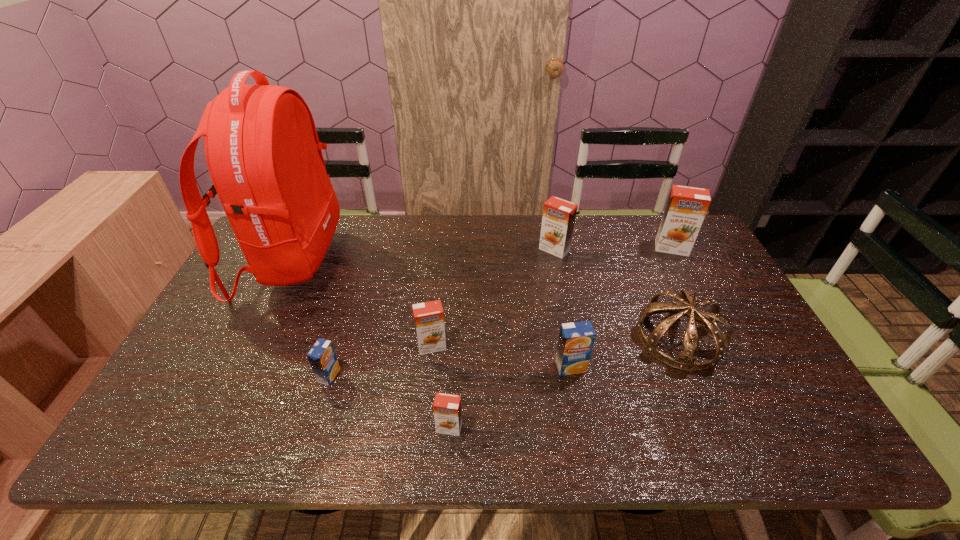
The width and height of the screenshot is (960, 540). What are the coordinates of `free spot at the near edge of the desktop` in the screenshot? It's located at (321, 418).

Image resolution: width=960 pixels, height=540 pixels. Identify the location of vacant space at the left edge of the desktop. (203, 369).

The image size is (960, 540). Identify the location of vacant space at the right edge. (732, 391).

Where is `free spot at the far right corner of the desktop`? This screenshot has height=540, width=960. free spot at the far right corner of the desktop is located at coordinates (701, 242).

At what (x,y) coordinates should I click in order to perform the action: click on vacant space that is in between the nearest object and the left blue orange_juice. Please return your answer as a coordinate pair (x, y). Looking at the image, I should click on (389, 401).

Locate an element on the screen. The image size is (960, 540). free area in between the third tallest object and the right blue orange_juice is located at coordinates (563, 308).

This screenshot has height=540, width=960. I want to click on free spot between the rightmost orange orange juice and the third orange orange juice from left to right, so click(x=613, y=249).

The height and width of the screenshot is (540, 960). I want to click on blank region between the third tallest object and the second nearest orange orange juice, so click(493, 298).

This screenshot has height=540, width=960. I want to click on free space between the third smallest orange orange juice and the third farthest orange juice, so click(493, 298).

This screenshot has width=960, height=540. Identify the location of vacant space that is in between the bigger blue orange_juice and the third tallest object. (563, 308).